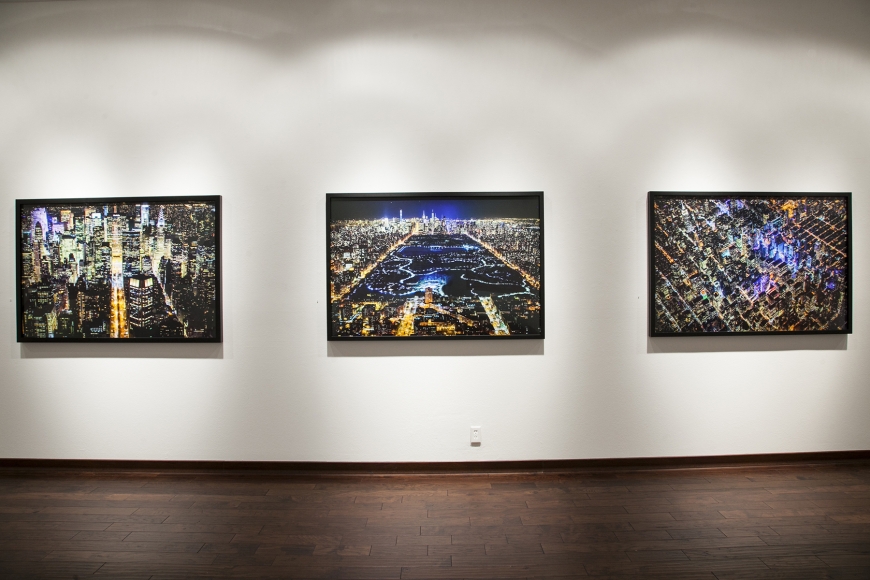
This screenshot has width=870, height=580. What are the coordinates of `first painting` in the screenshot? It's located at (156, 310).